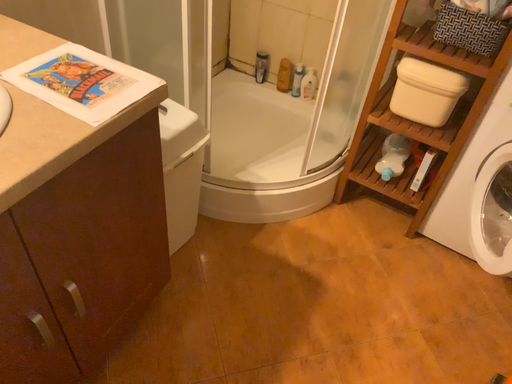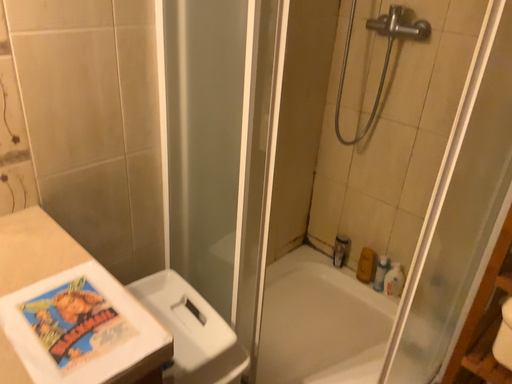
Question: Which way did the camera rotate in the video?

Choices:
 (A) rotated upward
 (B) rotated downward

Answer: (A)